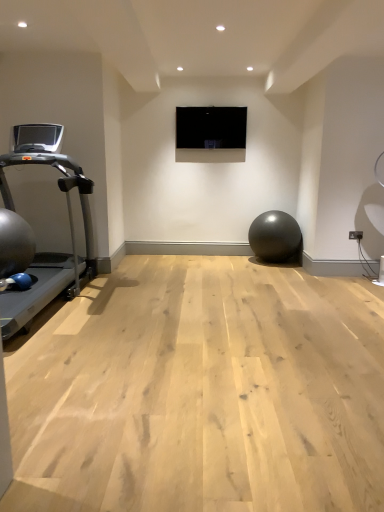
Question: Is the surface of silver metallic treadmill at left in direct contact with matte black ball at center?

Choices:
 (A) no
 (B) yes

Answer: (A)

Question: From a real-world perspective, is silver metallic treadmill at left over matte black ball at center?

Choices:
 (A) no
 (B) yes

Answer: (B)

Question: Is silver metallic treadmill at left to the left of matte black ball at center from the viewer's perspective?

Choices:
 (A) no
 (B) yes

Answer: (B)

Question: Is silver metallic treadmill at left positioned in front of matte black ball at center?

Choices:
 (A) no
 (B) yes

Answer: (B)

Question: Is silver metallic treadmill at left shorter than matte black ball at center?

Choices:
 (A) yes
 (B) no

Answer: (B)

Question: From the image's perspective, relative to silver metallic treadmill at left, is matte black ball at center above or below?

Choices:
 (A) above
 (B) below

Answer: (B)

Question: Relative to silver metallic treadmill at left, is matte black ball at center in front or behind?

Choices:
 (A) front
 (B) behind

Answer: (B)

Question: Is point coord(258,216) positioned closer to the camera than point coord(18,165)?

Choices:
 (A) closer
 (B) farther

Answer: (B)

Question: From a real-world perspective, is matte black ball at center physically located above or below silver metallic treadmill at left?

Choices:
 (A) below
 (B) above

Answer: (A)

Question: Does point (289, 238) appear closer or farther from the camera than point (241, 135)?

Choices:
 (A) farther
 (B) closer

Answer: (B)

Question: Is matte black ball at center taller or shorter than black glossy screen at center?

Choices:
 (A) short
 (B) tall

Answer: (B)

Question: From the image's perspective, is matte black ball at center positioned above or below black glossy screen at center?

Choices:
 (A) above
 (B) below

Answer: (B)

Question: Is matte black ball at center situated inside black glossy screen at center or outside?

Choices:
 (A) outside
 (B) inside

Answer: (A)

Question: Is black glossy screen at center spatially inside matte black ball at center, or outside of it?

Choices:
 (A) outside
 (B) inside

Answer: (A)

Question: In the image, is black glossy screen at center positioned in front of or behind matte black ball at center?

Choices:
 (A) front
 (B) behind

Answer: (B)